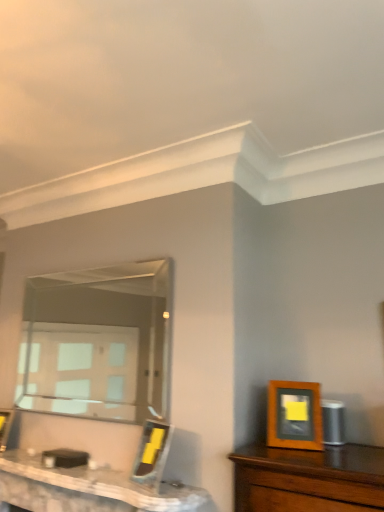
Find the location of a particular element. The height and width of the screenshot is (512, 384). vacant space to the right of wooden picture frame at center, which is counted as the 2th picture frame, starting from the left is located at coordinates (192, 489).